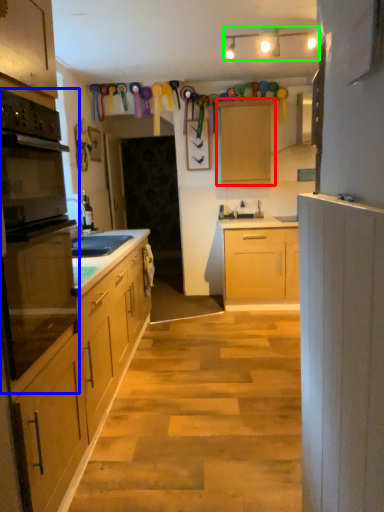
Question: Which is farther away from cabinetry (highlighted by a red box)? oven (highlighted by a blue box) or light fixture (highlighted by a green box)?

Choices:
 (A) oven
 (B) light fixture

Answer: (A)